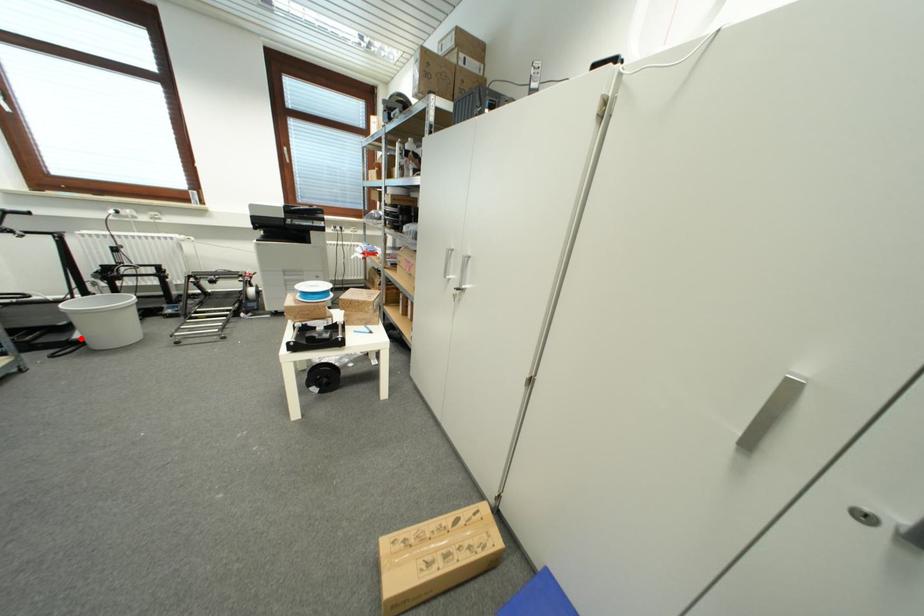
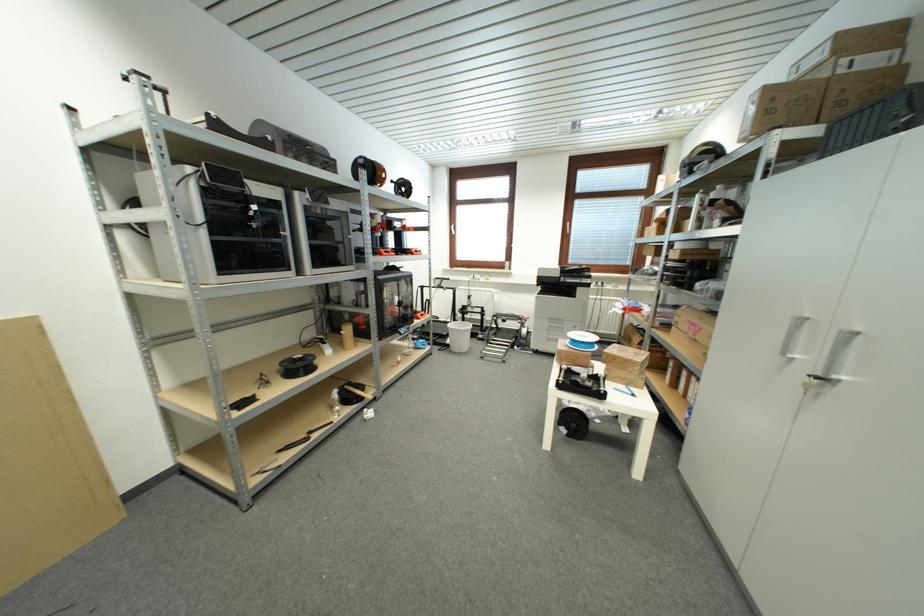
Question: I am providing you with two images of the same scene from different viewpoints. In image1, a red point is highlighted. Considering the same 3D point in image2, which of the following is correct?

Choices:
 (A) It is closer
 (B) It is farther

Answer: (B)